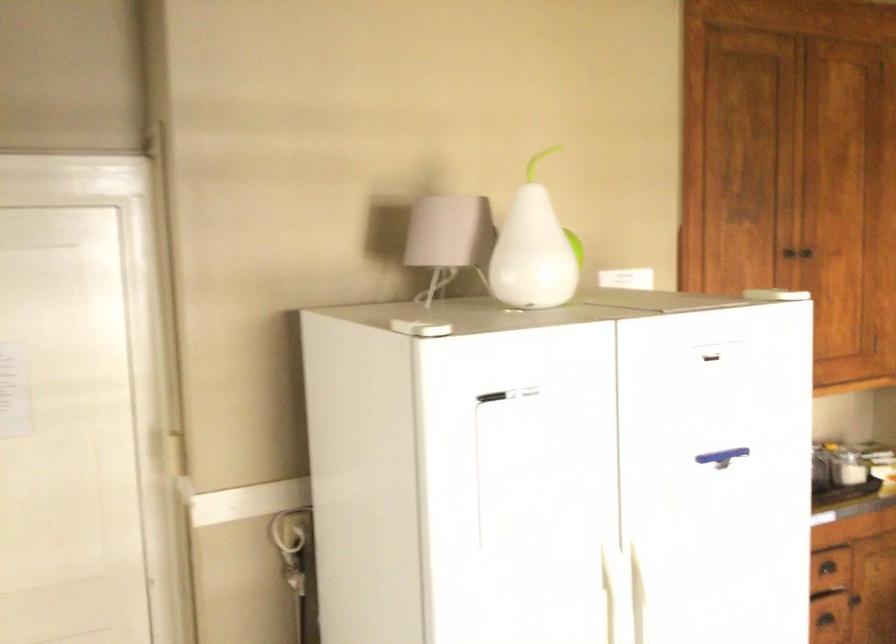
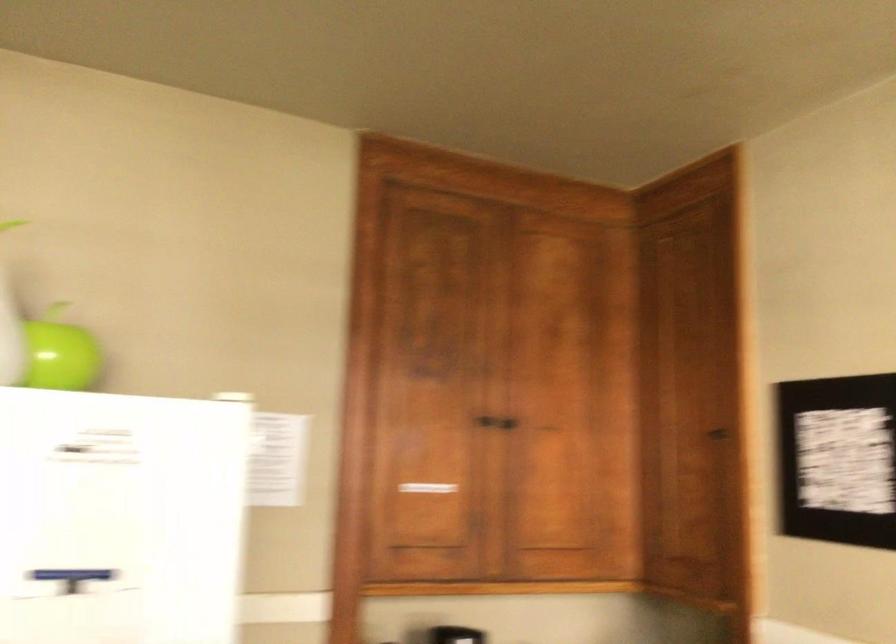
In the second image, find the point that corresponds to (x=556, y=257) in the first image.

(59, 353)